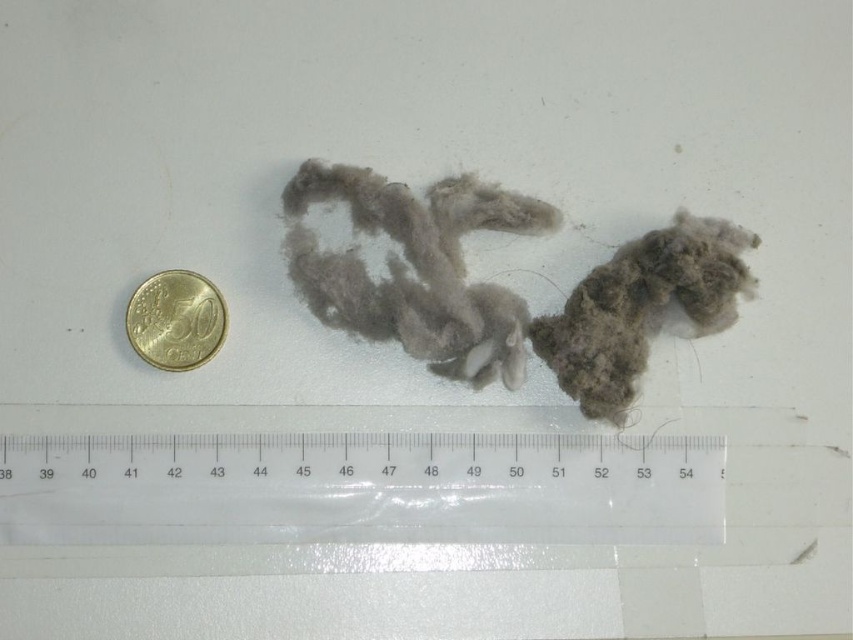
Question: Among these objects, which one is farthest from the camera?

Choices:
 (A) fuzzy gray fur at right
 (B) gold metallic coin at left
 (C) fuzzy gray fur at center

Answer: (C)

Question: Considering the relative positions of fuzzy gray fur at center and fuzzy gray fur at right in the image provided, where is fuzzy gray fur at center located with respect to fuzzy gray fur at right?

Choices:
 (A) right
 (B) left

Answer: (B)

Question: Which is nearer to the transparent plastic ruler at lower center?

Choices:
 (A) fuzzy gray fur at right
 (B) fuzzy gray fur at center

Answer: (B)

Question: Which of the following is the closest to the observer?

Choices:
 (A) gold metallic coin at left
 (B) fuzzy gray fur at center

Answer: (A)

Question: Is fuzzy gray fur at center to the right of gold metallic coin at left from the viewer's perspective?

Choices:
 (A) no
 (B) yes

Answer: (B)

Question: Can you confirm if fuzzy gray fur at center is smaller than fuzzy gray fur at right?

Choices:
 (A) no
 (B) yes

Answer: (A)